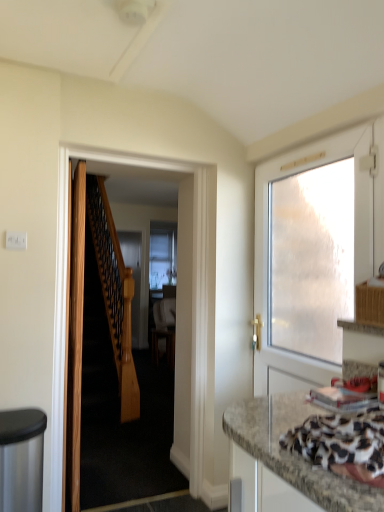
Question: Does white frosted glass door at right, which ranks as the 1th door in right-to-left order, have a smaller size compared to wooden door at left, which ranks as the first door in left-to-right order?

Choices:
 (A) yes
 (B) no

Answer: (B)

Question: Is white frosted glass door at right, which ranks as the 1th door in right-to-left order, bigger than wooden door at left, which ranks as the first door in left-to-right order?

Choices:
 (A) yes
 (B) no

Answer: (A)

Question: From the image's perspective, is white frosted glass door at right, which is counted as the 3th door, starting from the left, below wooden door at left, which ranks as the first door in left-to-right order?

Choices:
 (A) no
 (B) yes

Answer: (A)

Question: Can you confirm if white frosted glass door at right, which ranks as the 1th door in right-to-left order, is wider than wooden door at left, positioned as the 3th door in right-to-left order?

Choices:
 (A) no
 (B) yes

Answer: (B)

Question: Are white frosted glass door at right, which is counted as the 3th door, starting from the left, and wooden door at left, positioned as the 3th door in right-to-left order, far apart?

Choices:
 (A) yes
 (B) no

Answer: (A)

Question: From the image's perspective, is white frosted glass door at right, which is counted as the 3th door, starting from the left, over wooden door at left, positioned as the 3th door in right-to-left order?

Choices:
 (A) yes
 (B) no

Answer: (A)

Question: Does granite-patterned countertop at lower right appear on the left side of wooden door at center, which ranks as the second door in right-to-left order?

Choices:
 (A) yes
 (B) no

Answer: (B)

Question: Can you confirm if granite-patterned countertop at lower right is wider than wooden door at center, which ranks as the second door in right-to-left order?

Choices:
 (A) no
 (B) yes

Answer: (B)

Question: Is granite-patterned countertop at lower right closer to the viewer compared to wooden door at center, the second door when ordered from left to right?

Choices:
 (A) yes
 (B) no

Answer: (A)

Question: Is granite-patterned countertop at lower right oriented towards wooden door at center, the second door when ordered from left to right?

Choices:
 (A) no
 (B) yes

Answer: (A)

Question: Is granite-patterned countertop at lower right shorter than wooden door at center, which ranks as the second door in right-to-left order?

Choices:
 (A) yes
 (B) no

Answer: (A)

Question: Does granite-patterned countertop at lower right have a lesser width compared to wooden door at center, which ranks as the second door in right-to-left order?

Choices:
 (A) no
 (B) yes

Answer: (A)

Question: Does white frosted glass door at right, which ranks as the 1th door in right-to-left order, contain granite-patterned countertop at lower right?

Choices:
 (A) yes
 (B) no

Answer: (B)